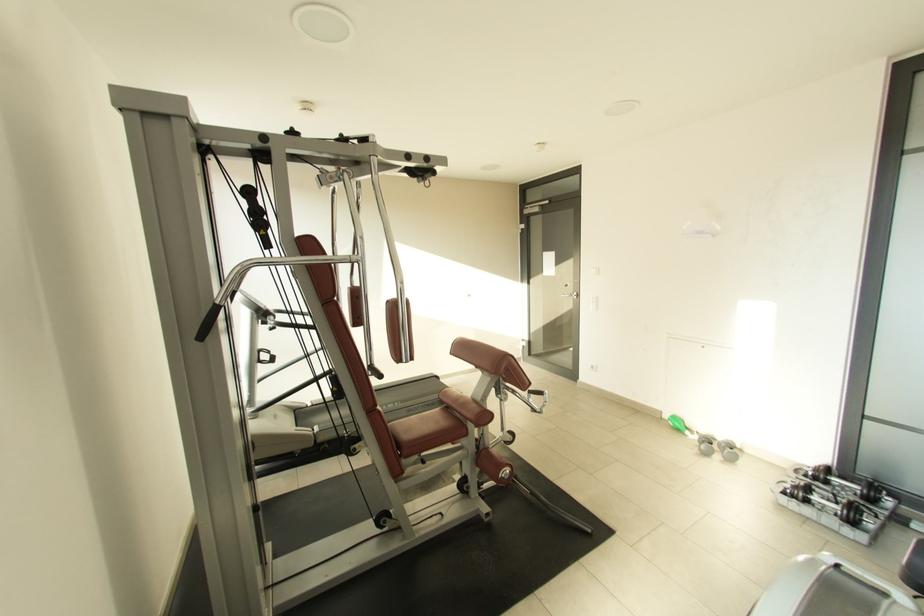
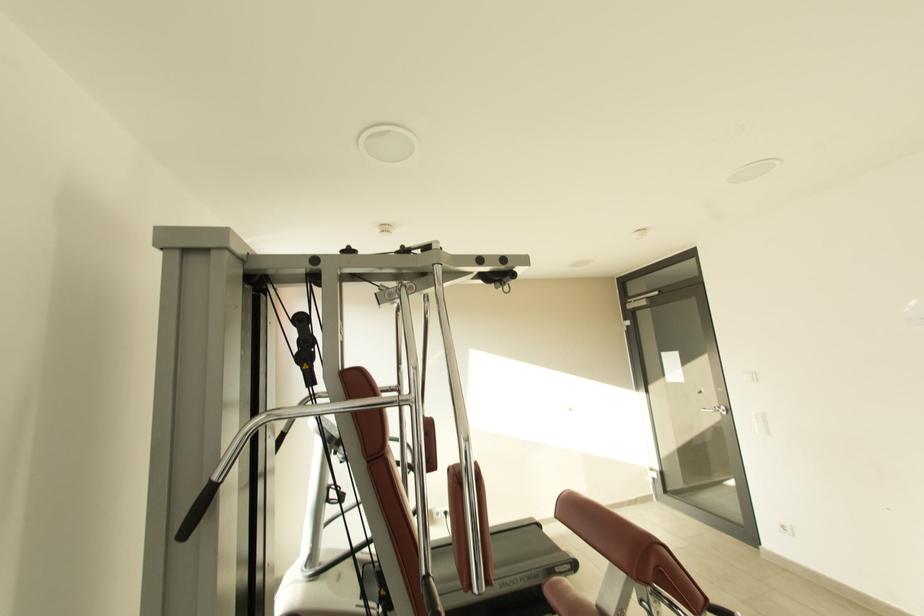
Question: Which direction would the cameraman need to move to produce the second image? Reply with the corresponding letter.

Choices:
 (A) Left
 (B) Right
 (C) Forward
 (D) Backward

Answer: (C)